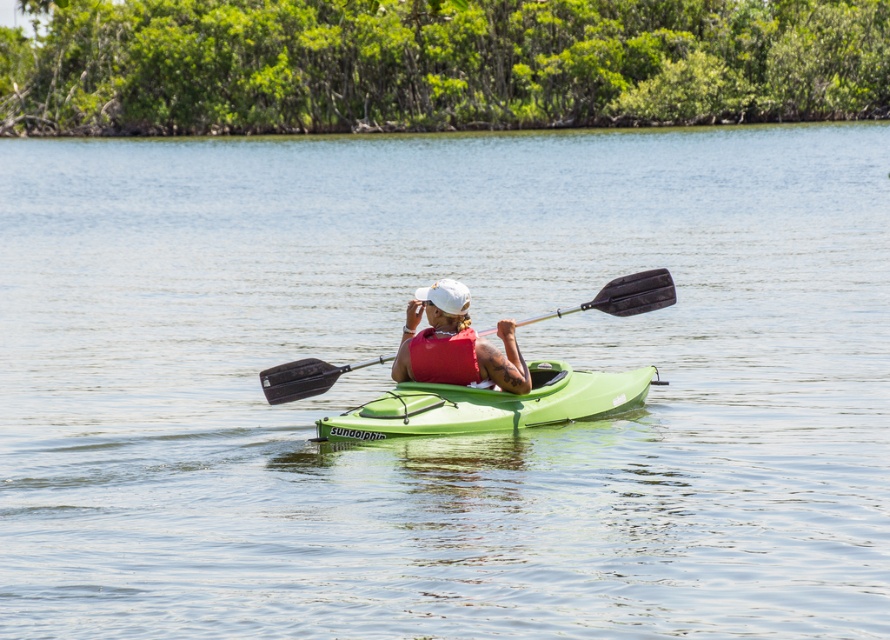
Question: Which object appears closest to the camera in this image?

Choices:
 (A) green matte kayak at center
 (B) white matte life vest at center
 (C) black rubber paddle at center

Answer: (A)

Question: Which point is closer to the camera taking this photo?

Choices:
 (A) (409, 365)
 (B) (659, 269)

Answer: (A)

Question: Which object appears farthest from the camera in this image?

Choices:
 (A) green matte kayak at center
 (B) white matte life vest at center

Answer: (B)

Question: Does green matte kayak at center appear under black rubber paddle at center?

Choices:
 (A) no
 (B) yes

Answer: (B)

Question: Considering the relative positions of white matte life vest at center and black rubber paddle at center in the image provided, where is white matte life vest at center located with respect to black rubber paddle at center?

Choices:
 (A) below
 (B) above

Answer: (A)

Question: Can you confirm if green matte kayak at center is bigger than black rubber paddle at center?

Choices:
 (A) no
 (B) yes

Answer: (B)